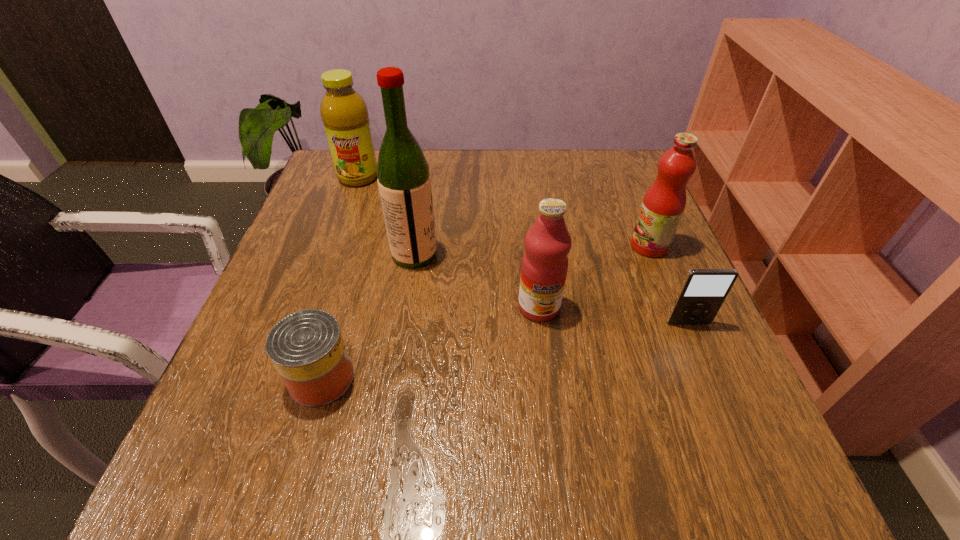
At what (x,y) coordinates should I click in order to perform the action: click on can that is at the left edge. Please return your answer as a coordinate pair (x, y). The width and height of the screenshot is (960, 540). Looking at the image, I should click on (307, 349).

Where is `fruit juice that is at the right edge`? fruit juice that is at the right edge is located at coordinates (663, 205).

The height and width of the screenshot is (540, 960). Identify the location of iPod located at the right edge. (703, 291).

I want to click on object that is at the far left corner, so click(x=344, y=113).

Where is `free space at the far edge of the desktop`? Image resolution: width=960 pixels, height=540 pixels. free space at the far edge of the desktop is located at coordinates (452, 176).

Locate an element on the screen. The height and width of the screenshot is (540, 960). free spot at the near edge of the desktop is located at coordinates (531, 469).

Where is `free point at the left edge`? The image size is (960, 540). free point at the left edge is located at coordinates (296, 409).

This screenshot has height=540, width=960. I want to click on free space at the right edge of the desktop, so click(x=648, y=347).

In the image, there is a desktop. At what (x,y) coordinates should I click in order to perform the action: click on vacant space at the far left corner. Please return your answer as a coordinate pair (x, y). This screenshot has height=540, width=960. Looking at the image, I should click on (367, 186).

You are a GUI agent. You are given a task and a screenshot of the screen. Output one action in this format:
    pyautogui.click(x=<x>, y=<y>)
    Task: Click on the vacant area at the far right corner
    The height and width of the screenshot is (540, 960).
    Given the screenshot: What is the action you would take?
    pyautogui.click(x=616, y=151)